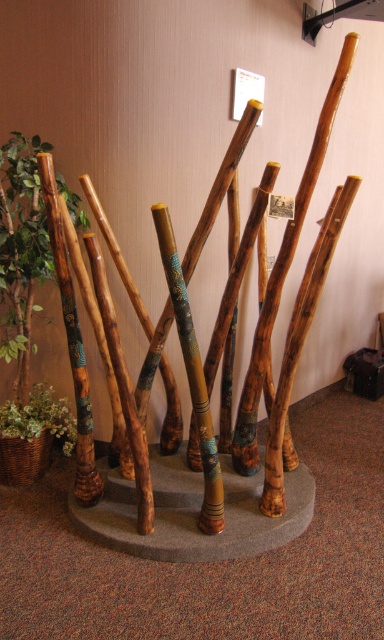
Does point (187, 323) come in front of point (43, 417)?

Yes.

The image size is (384, 640). What are the coordinates of `wooden painted staff at center` in the screenshot? It's located at (192, 372).

Find the location of a particular element. This screenshot has width=384, height=640. wooden painted staff at center is located at coordinates (192, 372).

Between green leafy plant at left and wooden painted staff at center, which one is positioned higher?

Positioned higher is green leafy plant at left.

Looking at this image, is green leafy plant at left closer to camera compared to wooden painted staff at center?

No.

Where is `green leafy plant at left`? The width and height of the screenshot is (384, 640). green leafy plant at left is located at coordinates (21, 248).

Who is shorter, natural wood cane at center or green leafy plant in woven basket at left?

green leafy plant in woven basket at left

Which is behind, point (49, 200) or point (9, 413)?

Point (9, 413)

Find the location of `natural wood cane at center`. natural wood cane at center is located at coordinates (72, 340).